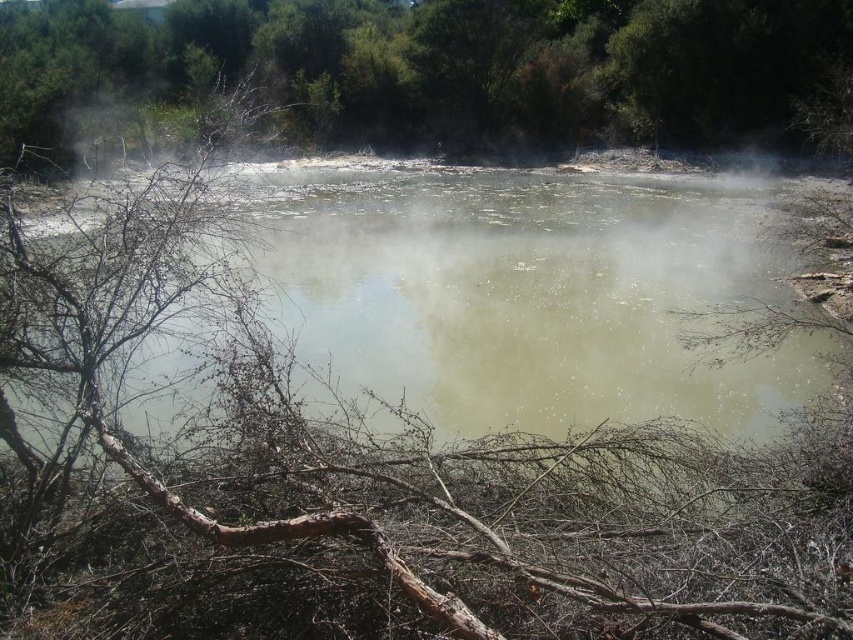
Is point (412, 182) more distant than point (151, 10)?

No, it is in front of (151, 10).

Is green murky water at center positioned at the back of green leafy tree at upper center?

No.

Which is behind, point (769, 376) or point (117, 68)?

Point (117, 68)

Identify the location of green murky water at center. (532, 292).